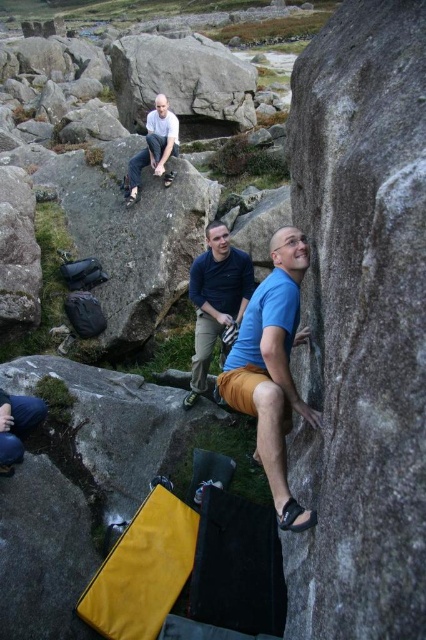
Question: Is blue fabric pants at center closer to camera compared to white matte shirt at upper center?

Choices:
 (A) no
 (B) yes

Answer: (B)

Question: Among these objects, which one is farthest from the camera?

Choices:
 (A) blue matte shirt at center
 (B) gray rough rock at right

Answer: (A)

Question: Can you confirm if blue matte shirt at center is thinner than blue fabric pants at center?

Choices:
 (A) yes
 (B) no

Answer: (A)

Question: Where is blue matte shirt at center located in relation to white matte shirt at upper center in the image?

Choices:
 (A) left
 (B) right

Answer: (B)

Question: Which point is farther to the camera?

Choices:
 (A) (402, 547)
 (B) (229, 272)
 (C) (126, 188)
 (D) (276, 353)

Answer: (C)

Question: Which point is closer to the camera?

Choices:
 (A) (221, 272)
 (B) (173, 129)

Answer: (A)